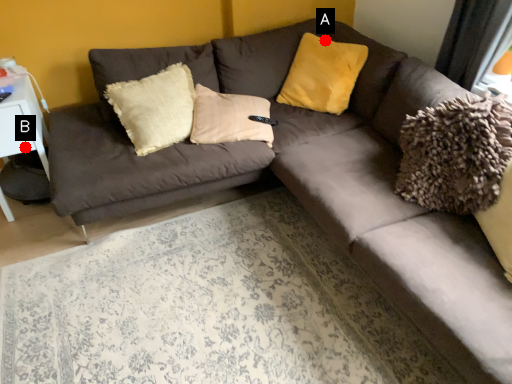
Question: Two points are circled on the image, labeled by A and B beside each circle. Which point is closer to the camera?

Choices:
 (A) A is closer
 (B) B is closer

Answer: (B)